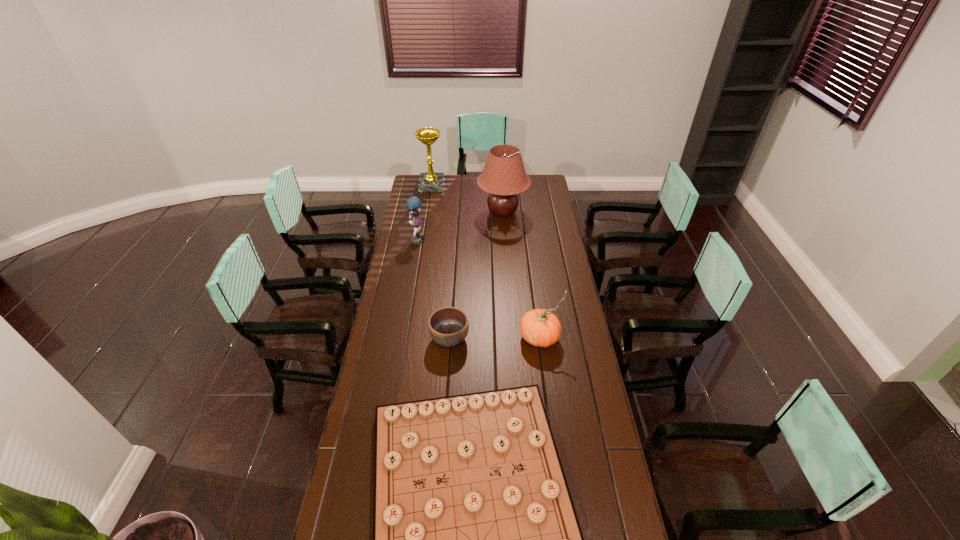
Where is `vacant space that is in between the award and the lampshade`? vacant space that is in between the award and the lampshade is located at coordinates (468, 199).

I want to click on free point between the second shortest object and the pumpkin, so click(495, 338).

What are the coordinates of `vacant space that's between the second shortest object and the award` in the screenshot? It's located at (441, 262).

Identify the location of empty space between the bowl and the lampshade. The image size is (960, 540). (476, 275).

Identify the location of vacant area between the second farthest object and the fifth tallest object. The image size is (960, 540). point(476,275).

You are a GUI agent. You are given a task and a screenshot of the screen. Output one action in this format:
    pyautogui.click(x=<x>, y=<y>)
    Task: Click on the vacant area that lies between the second farthest object and the rag doll
    The width and height of the screenshot is (960, 540).
    Given the screenshot: What is the action you would take?
    pyautogui.click(x=460, y=225)

Select which object appears as the fourth closest to the bowl. Please provide its 2D coordinates. Your answer should be formatted as a tuple, i.e. [(x, y)], where the tuple contains the x and y coordinates of a point satisfying the conditions above.

[(503, 176)]

Identify which object is located as the fifth nearest to the bowl. Please provide its 2D coordinates. Your answer should be formatted as a tuple, i.e. [(x, y)], where the tuple contains the x and y coordinates of a point satisfying the conditions above.

[(428, 182)]

At what (x,y) coordinates should I click in order to perform the action: click on blank space that satisfies the following two spatial constraints: 1. on the front-facing side of the pumpkin; 2. on the right side of the lampshade. Please return your answer as a coordinate pair (x, y). Image resolution: width=960 pixels, height=540 pixels. Looking at the image, I should click on (511, 337).

The image size is (960, 540). I want to click on free space that satisfies the following two spatial constraints: 1. on the back side of the pumpkin; 2. on the right side of the second shortest object, so click(x=449, y=337).